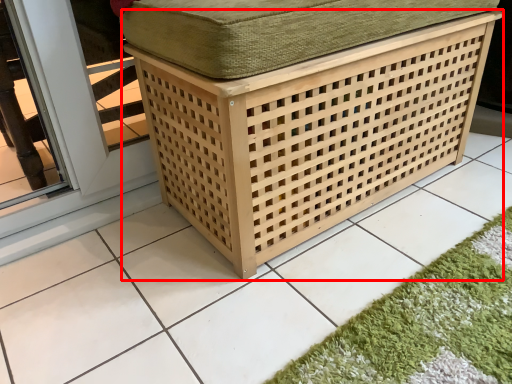
Question: From the image, what is the correct spatial relationship of furniture (annotated by the red box) in relation to bath mat?

Choices:
 (A) left
 (B) right

Answer: (A)